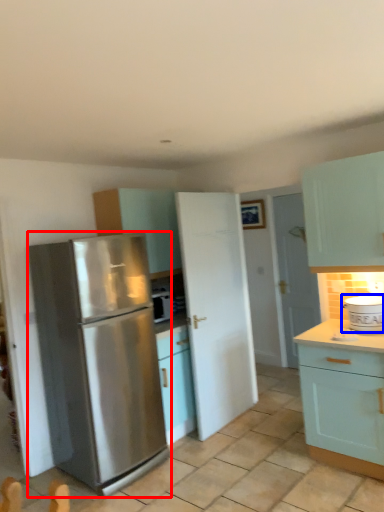
Question: Which object is further to the camera taking this photo, refrigerator (highlighted by a red box) or appliance (highlighted by a blue box)?

Choices:
 (A) refrigerator
 (B) appliance

Answer: (B)